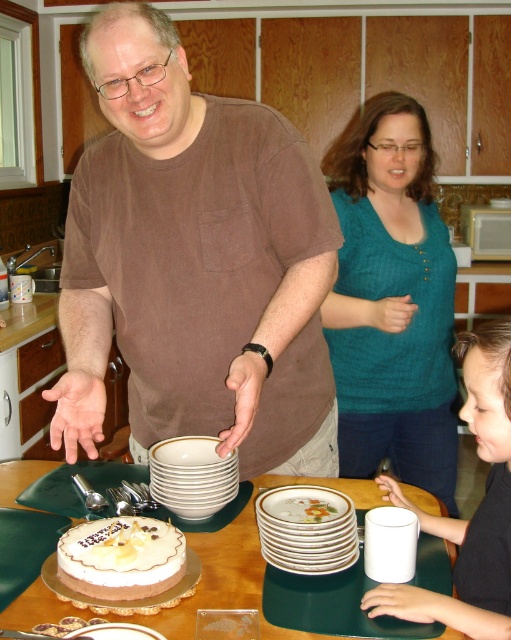
Is point (431, 234) more distant than point (476, 381)?

Yes, point (431, 234) is behind point (476, 381).

Is point (442, 285) positioned behind point (480, 420)?

Yes, point (442, 285) is behind point (480, 420).

Locate an element on the screen. teal knit shirt at center is located at coordinates (392, 301).

Can you confirm if white glossy plates at center is bigger than white frosted cake at center?

Yes.

Is point (228, 602) positioned in front of point (125, 536)?

Yes, it is.

I want to click on white glossy plates at center, so click(223, 582).

Is teal knit shirt at center shorter than porcelain plates at center?

No, teal knit shirt at center is not shorter than porcelain plates at center.

Is teal knit shirt at center positioned before porcelain plates at center?

No, teal knit shirt at center is further to the viewer.

Based on the photo, who is more distant from viewer, (435, 308) or (273, 522)?

Point (435, 308)

In order to click on teal knit shirt at center in this screenshot , I will do `click(392, 301)`.